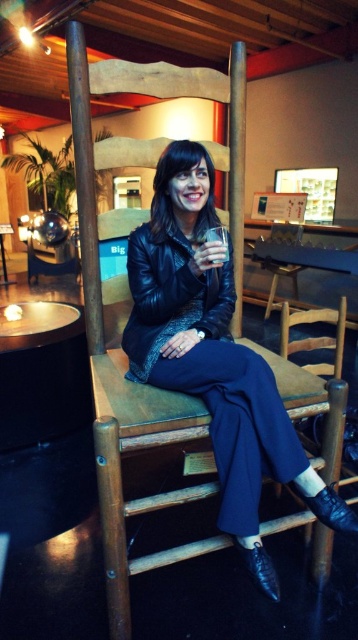
Consider the image. You are an art curator planning to photograph the leather jacket at center and the wooden chair at center for an exhibition catalog. Based on their current positions, which object is closer to the camera lens?

The leather jacket at center is positioned under the wooden chair at center, meaning it is closer to the camera lens than the wooden chair at center.

You are a security guard in the museum and need to check the items around the person. Where is the black leather jacket at center positioned relative to the person?

The black leather jacket at center is located at point (171, 296), which means it is positioned at the center of the image, directly on the person since the coordinates indicate the exact center point.